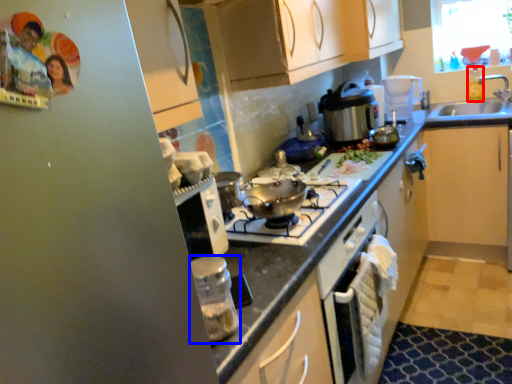
Question: Which point is further to the camera, bottle (highlighted by a red box) or kitchen appliance (highlighted by a blue box)?

Choices:
 (A) bottle
 (B) kitchen appliance

Answer: (A)